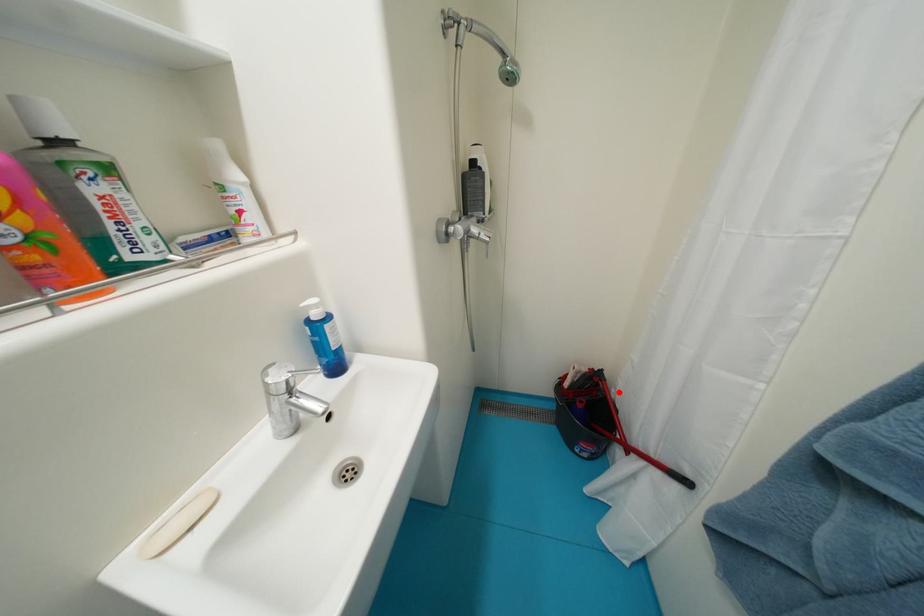
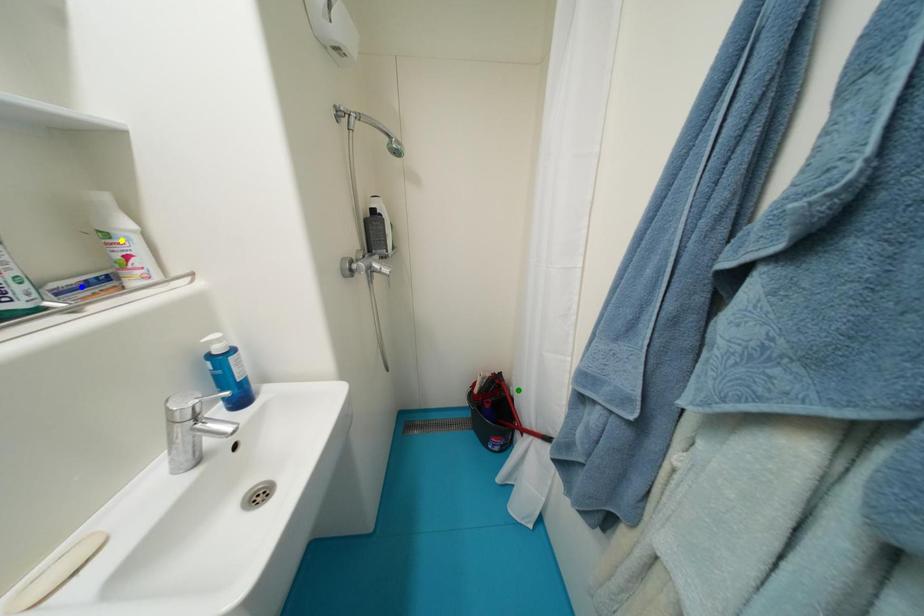
Question: I am providing you with two images of the same scene from different viewpoints. A red point is marked on the first image. You are given multiple points on the second image. Which spot in image 2 lines up with the point in image 1?

Choices:
 (A) green point
 (B) yellow point
 (C) blue point

Answer: (A)